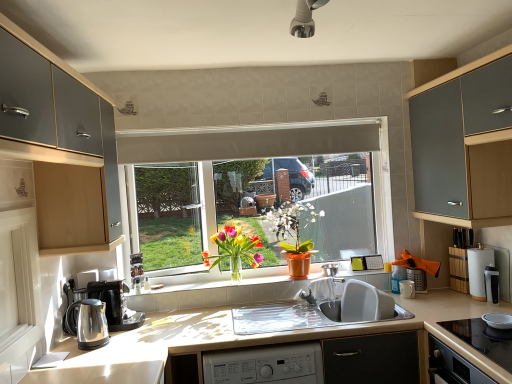
Question: From the image's perspective, is metallic silver pot at center, placed as the 1th appliance when sorted from left to right, on white glossy screen door at left?

Choices:
 (A) yes
 (B) no

Answer: (B)

Question: Can we say metallic silver pot at center, the 5th appliance from the front, lies outside white glossy screen door at left?

Choices:
 (A) yes
 (B) no

Answer: (A)

Question: Does metallic silver pot at center, the 5th appliance from the front, have a lesser height compared to white glossy screen door at left?

Choices:
 (A) no
 (B) yes

Answer: (B)

Question: From the image's perspective, does metallic silver pot at center, the 1th appliance when ordered from back to front, appear lower than white glossy screen door at left?

Choices:
 (A) no
 (B) yes

Answer: (B)

Question: Can you confirm if metallic silver pot at center, placed as the 1th appliance when sorted from left to right, is positioned to the left of white glossy screen door at left?

Choices:
 (A) yes
 (B) no

Answer: (B)

Question: Choose the correct answer: Is matte silver utensil holder at right, the third appliance when ordered from left to right, inside metallic silver pot at center, the 1th appliance when ordered from back to front, or outside it?

Choices:
 (A) inside
 (B) outside

Answer: (B)

Question: Considering the relative positions of matte silver utensil holder at right, marked as the 4th appliance in a front-to-back arrangement, and metallic silver pot at center, placed as the 1th appliance when sorted from left to right, in the image provided, is matte silver utensil holder at right, marked as the 4th appliance in a front-to-back arrangement, to the left or to the right of metallic silver pot at center, placed as the 1th appliance when sorted from left to right,?

Choices:
 (A) right
 (B) left

Answer: (A)

Question: Is matte silver utensil holder at right, the second appliance in the back-to-front sequence, in front of or behind metallic silver pot at center, placed as the 1th appliance when sorted from left to right, in the image?

Choices:
 (A) behind
 (B) front

Answer: (B)

Question: From the image's perspective, is matte silver utensil holder at right, which is the third appliance in right-to-left order, located above or below metallic silver pot at center, the 5th appliance from the front?

Choices:
 (A) above
 (B) below

Answer: (B)

Question: Is point (261, 291) positioned closer to the camera than point (273, 228)?

Choices:
 (A) farther
 (B) closer

Answer: (A)

Question: From a real-world perspective, relative to orange matte pot at center, the 1th floral arrangement viewed from the right, is white tile at center vertically above or below?

Choices:
 (A) below
 (B) above

Answer: (A)

Question: From the image's perspective, relative to orange matte pot at center, which appears as the second floral arrangement when viewed from the left, is white tile at center above or below?

Choices:
 (A) below
 (B) above

Answer: (A)

Question: Is white tile at center inside or outside of orange matte pot at center, the 1th floral arrangement viewed from the right?

Choices:
 (A) inside
 (B) outside

Answer: (B)

Question: Is point (357, 182) positioned closer to the camera than point (304, 248)?

Choices:
 (A) closer
 (B) farther

Answer: (B)

Question: In terms of height, does matte white window at center look taller or shorter compared to orange matte pot at center, which appears as the second floral arrangement when viewed from the left?

Choices:
 (A) tall
 (B) short

Answer: (A)